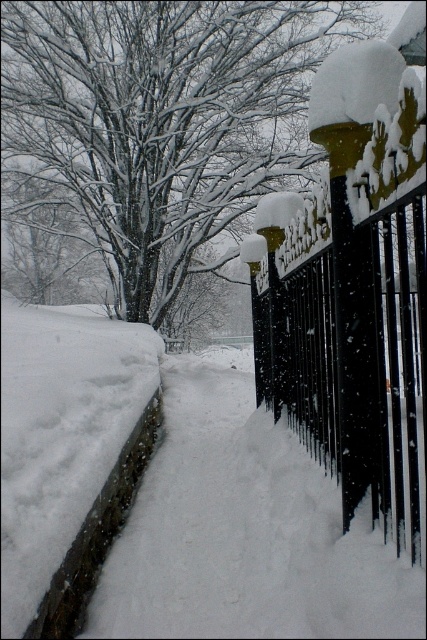
Is point (23, 58) in front of point (328, 387)?

No, it is not.

Who is more forward, (111,58) or (382,115)?

Positioned in front is point (382,115).

Find the location of `snow-covered tree at upper left`. snow-covered tree at upper left is located at coordinates (160, 124).